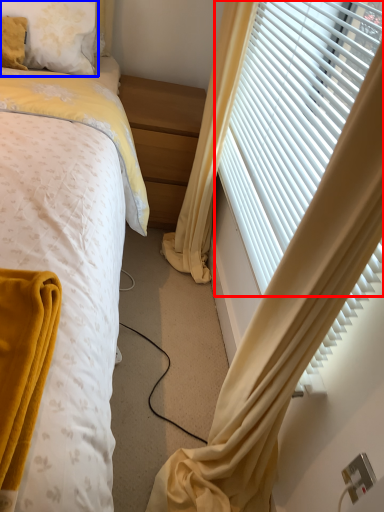
Question: Which of the following is the farthest to the observer, window blind (highlighted by a red box) or pillow (highlighted by a blue box)?

Choices:
 (A) window blind
 (B) pillow

Answer: (B)